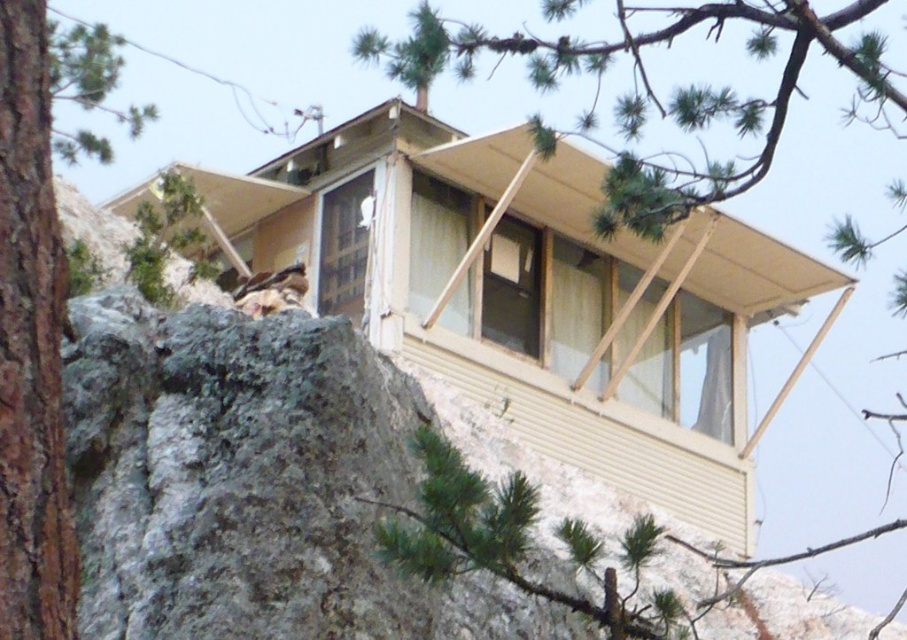
Between green pine tree at upper center and brown rough bark tree at left, which one appears on the right side from the viewer's perspective?

From the viewer's perspective, green pine tree at upper center appears more on the right side.

Is green pine tree at upper center to the right of brown rough bark tree at left from the viewer's perspective?

Indeed, green pine tree at upper center is positioned on the right side of brown rough bark tree at left.

Which is in front, point (646, 177) or point (38, 564)?

Point (38, 564)

The image size is (907, 640). In order to click on green pine tree at upper center in this screenshot , I will do `click(652, 93)`.